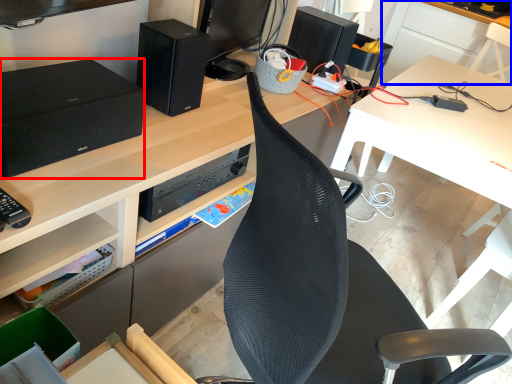
Question: Which object is further to the camera taking this photo, speaker (highlighted by a red box) or table (highlighted by a blue box)?

Choices:
 (A) speaker
 (B) table

Answer: (B)